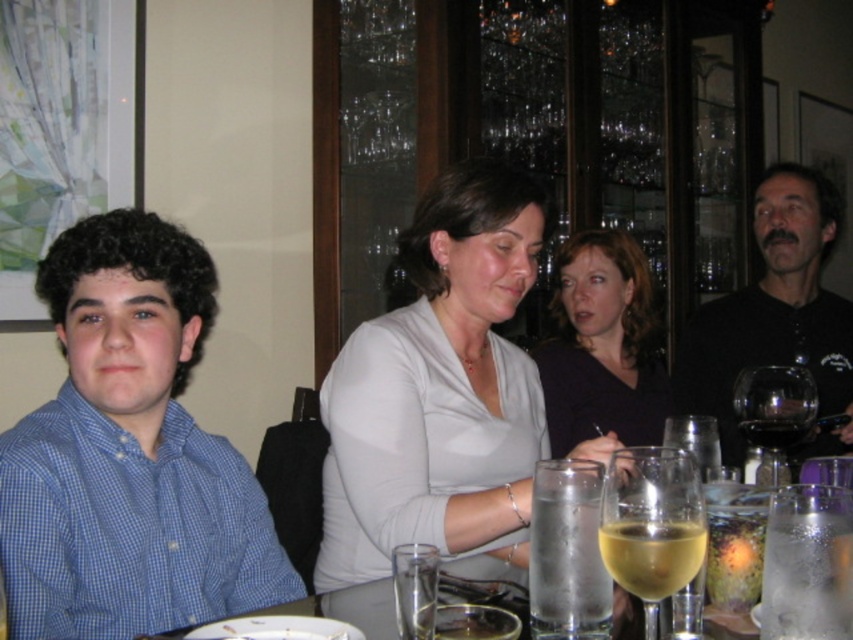
From the picture: Can you confirm if dark purple shirt at center is smaller than clear glass wine at center?

No.

Is point (549, 371) positioned before point (775, 436)?

No, it is not.

I want to click on dark purple shirt at center, so click(601, 346).

Can you confirm if blue checkered shirt at left is shorter than dark purple shirt at center?

No.

This screenshot has width=853, height=640. Describe the element at coordinates (129, 452) in the screenshot. I see `blue checkered shirt at left` at that location.

Locate an element on the screen. blue checkered shirt at left is located at coordinates (129, 452).

Can you confirm if blue checkered shirt at left is smaller than transparent glass wine glass at right?

No, blue checkered shirt at left is not smaller than transparent glass wine glass at right.

The height and width of the screenshot is (640, 853). What are the coordinates of `blue checkered shirt at left` in the screenshot? It's located at (129, 452).

Which is behind, point (215, 481) or point (769, 449)?

Point (769, 449)

Find the location of a particular element. The height and width of the screenshot is (640, 853). blue checkered shirt at left is located at coordinates (129, 452).